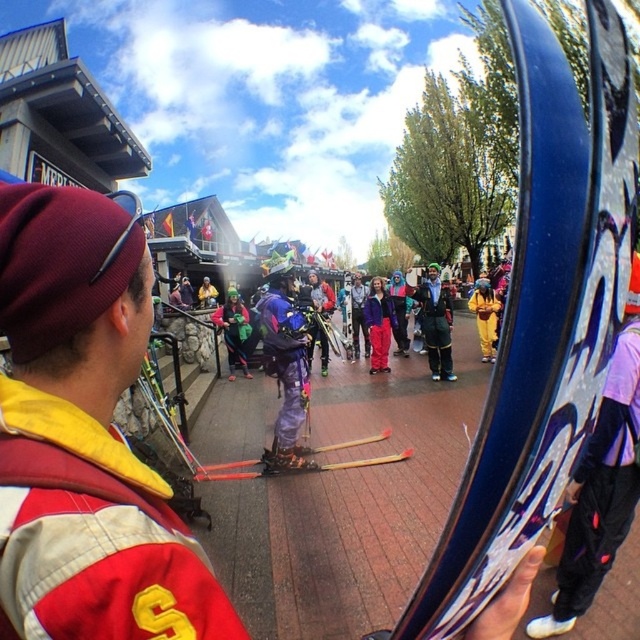
Question: Which of the following is the closest to the observer?

Choices:
 (A) (296, 413)
 (B) (241, 317)

Answer: (A)

Question: From the image, what is the correct spatial relationship of shiny metallic jacket at center in relation to yellow fabric pants at center?

Choices:
 (A) right
 (B) left

Answer: (B)

Question: Which is farther from the shiny purple ski suit at center?

Choices:
 (A) yellow fabric pants at center
 (B) matte purple jacket at center
 (C) shiny metallic jacket at center
 (D) purple matte ski pants at center

Answer: (A)

Question: Does matte purple jacket at center appear on the left side of yellow fabric pants at center?

Choices:
 (A) no
 (B) yes

Answer: (B)

Question: Is purple matte ski pants at center to the left of shiny metallic jacket at center from the viewer's perspective?

Choices:
 (A) yes
 (B) no

Answer: (A)

Question: Among these points, which one is farthest from the camera?

Choices:
 (A) (292, 352)
 (B) (236, 320)

Answer: (B)